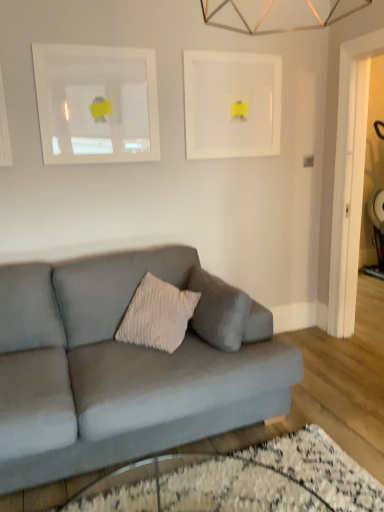
Locate an element on the screen. white matte picture frame at upper center, which is the second picture frame from left to right is located at coordinates (231, 103).

Does white matte picture frame at upper left, which is the second picture frame from right to left, have a lesser width compared to transparent glass table at lower center?

Yes, white matte picture frame at upper left, which is the second picture frame from right to left, is thinner than transparent glass table at lower center.

Is white matte picture frame at upper left, which ranks as the first picture frame in left-to-right order, positioned with its back to transparent glass table at lower center?

white matte picture frame at upper left, which ranks as the first picture frame in left-to-right order, is not turned away from transparent glass table at lower center.

Is point (115, 140) positioned behind point (316, 479)?

Yes.

Between white matte picture frame at upper left, which is the second picture frame from right to left, and transparent glass table at lower center, which one appears on the right side from the viewer's perspective?

transparent glass table at lower center is more to the right.

Does matte gray couch at center touch transparent glass table at lower center?

No.

How far apart are matte gray couch at center and transparent glass table at lower center?

matte gray couch at center is 49.80 centimeters from transparent glass table at lower center.

Which is further, (54,437) or (323,511)?

The point (54,437) is more distant.

Between matte gray couch at center and transparent glass table at lower center, which one has larger size?

matte gray couch at center is bigger.

Is white matte picture frame at upper center, the 1th picture frame viewed from the right, turned away from transparent glass table at lower center?

white matte picture frame at upper center, the 1th picture frame viewed from the right, is not turned away from transparent glass table at lower center.

From their relative heights in the image, would you say white matte picture frame at upper center, the 1th picture frame viewed from the right, is taller or shorter than transparent glass table at lower center?

In the image, white matte picture frame at upper center, the 1th picture frame viewed from the right, appears to be taller than transparent glass table at lower center.

Which is less distant, [197,83] or [348,509]?

Point [197,83] appears to be farther away from the viewer than point [348,509].

Which is more to the right, white matte picture frame at upper center, the 1th picture frame viewed from the right, or transparent glass table at lower center?

white matte picture frame at upper center, the 1th picture frame viewed from the right.

Which of these two, matte gray couch at center or white matte picture frame at upper center, the 1th picture frame viewed from the right, is thinner?

Thinner between the two is white matte picture frame at upper center, the 1th picture frame viewed from the right.

Does matte gray couch at center touch white matte picture frame at upper center, which is the second picture frame from left to right?

No, matte gray couch at center is not beside white matte picture frame at upper center, which is the second picture frame from left to right.

Considering the positions of point (87, 468) and point (251, 62), is point (87, 468) closer or farther from the camera than point (251, 62)?

Point (87, 468).

Is matte gray couch at center inside or outside of white matte picture frame at upper center, the 1th picture frame viewed from the right?

matte gray couch at center is located beyond the bounds of white matte picture frame at upper center, the 1th picture frame viewed from the right.

Is white matte picture frame at upper left, which is the second picture frame from right to left, turned away from matte gray couch at center?

No.

Looking at their sizes, would you say white matte picture frame at upper left, which is the second picture frame from right to left, is wider or thinner than matte gray couch at center?

white matte picture frame at upper left, which is the second picture frame from right to left, is thinner than matte gray couch at center.

Can you confirm if white matte picture frame at upper left, which is the second picture frame from right to left, is smaller than matte gray couch at center?

Indeed, white matte picture frame at upper left, which is the second picture frame from right to left, has a smaller size compared to matte gray couch at center.

In the image, is white matte picture frame at upper center, which is the second picture frame from left to right, on the left side or the right side of matte gray couch at center?

white matte picture frame at upper center, which is the second picture frame from left to right, is positioned on matte gray couch at center's right side.

From a real-world perspective, which object rests below the other?

matte gray couch at center, from a real-world perspective.

Is white matte picture frame at upper center, which is the second picture frame from left to right, aimed at matte gray couch at center?

No, white matte picture frame at upper center, which is the second picture frame from left to right, is not oriented towards matte gray couch at center.

Considering the relative sizes of white matte picture frame at upper center, which is the second picture frame from left to right, and matte gray couch at center in the image provided, is white matte picture frame at upper center, which is the second picture frame from left to right, bigger than matte gray couch at center?

No, white matte picture frame at upper center, which is the second picture frame from left to right, is not bigger than matte gray couch at center.

Is transparent glass table at lower center far away from white matte picture frame at upper left, which is the second picture frame from right to left?

That's right, there is a large distance between transparent glass table at lower center and white matte picture frame at upper left, which is the second picture frame from right to left.

From a real-world perspective, is transparent glass table at lower center positioned under white matte picture frame at upper left, which is the second picture frame from right to left, based on gravity?

Correct, in the physical world, transparent glass table at lower center is lower than white matte picture frame at upper left, which is the second picture frame from right to left.

Does transparent glass table at lower center come behind white matte picture frame at upper left, which is the second picture frame from right to left?

No, the depth of transparent glass table at lower center is less than that of white matte picture frame at upper left, which is the second picture frame from right to left.

In the image, is transparent glass table at lower center on the left side or the right side of white matte picture frame at upper left, which is the second picture frame from right to left?

Clearly, transparent glass table at lower center is on the right of white matte picture frame at upper left, which is the second picture frame from right to left, in the image.

The width and height of the screenshot is (384, 512). There is a transparent glass table at lower center. In order to click on the 1st picture frame above it (from the image's perspective) in this screenshot , I will do `click(96, 104)`.

The height and width of the screenshot is (512, 384). In order to click on glass table in front of the matte gray couch at center in this screenshot , I will do `click(242, 481)`.

Considering their positions, is white matte picture frame at upper center, the 1th picture frame viewed from the right, positioned further to matte gray couch at center than transparent glass table at lower center?

Among the two, white matte picture frame at upper center, the 1th picture frame viewed from the right, is located further to matte gray couch at center.

Estimate the real-world distances between objects in this image. Which object is further from transparent glass table at lower center, white matte picture frame at upper center, which is the second picture frame from left to right, or matte gray couch at center?

white matte picture frame at upper center, which is the second picture frame from left to right.

Which object lies further to the anchor point white matte picture frame at upper center, the 1th picture frame viewed from the right, matte gray couch at center or white matte picture frame at upper left, which is the second picture frame from right to left?

The object further to white matte picture frame at upper center, the 1th picture frame viewed from the right, is matte gray couch at center.

When comparing their distances from matte gray couch at center, does transparent glass table at lower center or white matte picture frame at upper left, which ranks as the first picture frame in left-to-right order, seem closer?

transparent glass table at lower center lies closer to matte gray couch at center than the other object.

Looking at the image, which one is located further to matte gray couch at center, white matte picture frame at upper left, which ranks as the first picture frame in left-to-right order, or white matte picture frame at upper center, which is the second picture frame from left to right?

The object further to matte gray couch at center is white matte picture frame at upper center, which is the second picture frame from left to right.

Which object lies nearer to the anchor point white matte picture frame at upper left, which is the second picture frame from right to left, white matte picture frame at upper center, the 1th picture frame viewed from the right, or matte gray couch at center?

Based on the image, white matte picture frame at upper center, the 1th picture frame viewed from the right, appears to be nearer to white matte picture frame at upper left, which is the second picture frame from right to left.

From the image, which object appears to be nearer to matte gray couch at center, transparent glass table at lower center or white matte picture frame at upper center, which is the second picture frame from left to right?

transparent glass table at lower center.

Based on their spatial positions, is matte gray couch at center or white matte picture frame at upper center, which is the second picture frame from left to right, further from white matte picture frame at upper left, which ranks as the first picture frame in left-to-right order?

Among the two, matte gray couch at center is located further to white matte picture frame at upper left, which ranks as the first picture frame in left-to-right order.

Where is `picture frame between white matte picture frame at upper center, which is the second picture frame from left to right, and transparent glass table at lower center from top to bottom`? This screenshot has height=512, width=384. picture frame between white matte picture frame at upper center, which is the second picture frame from left to right, and transparent glass table at lower center from top to bottom is located at coordinates (96, 104).

I want to click on picture frame between white matte picture frame at upper center, the 1th picture frame viewed from the right, and matte gray couch at center in the up-down direction, so click(96, 104).

Locate an element on the screen. This screenshot has width=384, height=512. studio couch between white matte picture frame at upper center, which is the second picture frame from left to right, and transparent glass table at lower center, in the vertical direction is located at coordinates (124, 367).

Image resolution: width=384 pixels, height=512 pixels. I want to click on studio couch between white matte picture frame at upper left, which is the second picture frame from right to left, and transparent glass table at lower center, in the vertical direction, so click(124, 367).